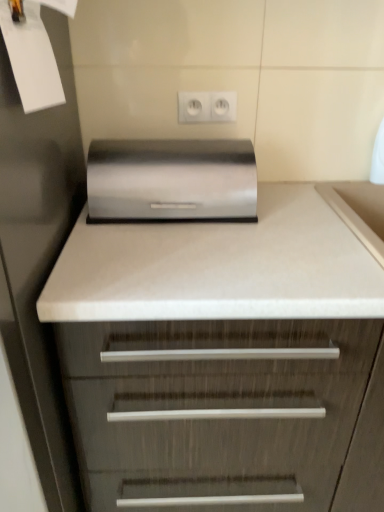
You are a GUI agent. You are given a task and a screenshot of the screen. Output one action in this format:
    pyautogui.click(x=<x>, y=<y>)
    Task: Click on the vacant space situated above satin wood chest of drawers at center (from a real-world perspective)
    Image resolution: width=384 pixels, height=512 pixels.
    Given the screenshot: What is the action you would take?
    pyautogui.click(x=258, y=232)